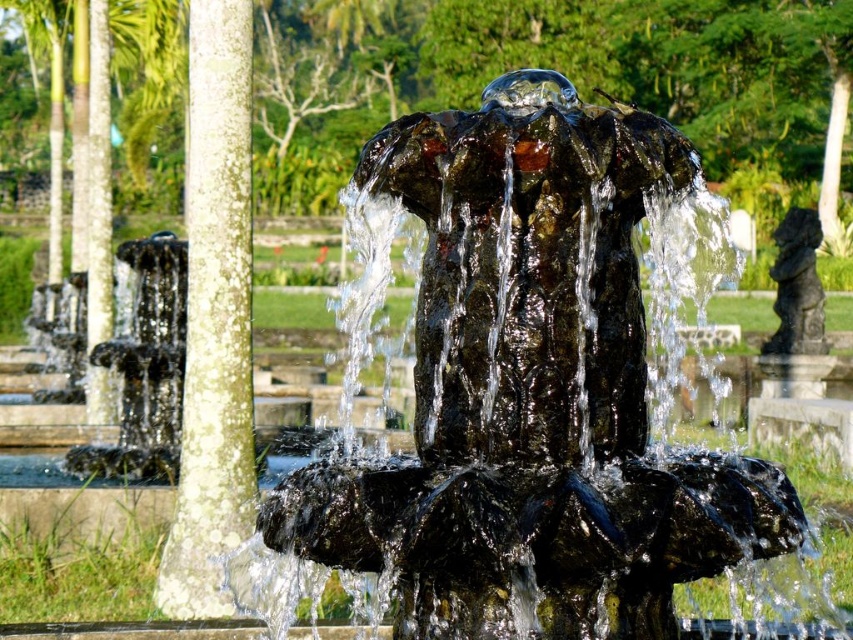
Can you confirm if black stone fountain at center is wider than black stone pillar at left?

Yes, black stone fountain at center is wider than black stone pillar at left.

Does black stone fountain at center have a lesser height compared to black stone pillar at left?

Yes, black stone fountain at center is shorter than black stone pillar at left.

Describe the element at coordinates (531, 392) in the screenshot. This screenshot has width=853, height=640. I see `black stone fountain at center` at that location.

Where is `black stone fountain at center`? This screenshot has height=640, width=853. black stone fountain at center is located at coordinates (531, 392).

Which is in front, point (627, 344) or point (788, 212)?

Point (627, 344) is more forward.

Where is `black stone fountain at center`? black stone fountain at center is located at coordinates (531, 392).

Is white lichen-covered pillar at left to the left of black stone pillar at left from the viewer's perspective?

In fact, white lichen-covered pillar at left is to the right of black stone pillar at left.

Between white lichen-covered pillar at left and black stone pillar at left, which one is positioned lower?

Positioned lower is black stone pillar at left.

Which is in front, point (229, 614) or point (106, 67)?

Point (229, 614)

This screenshot has width=853, height=640. Identify the location of white lichen-covered pillar at left. (213, 320).